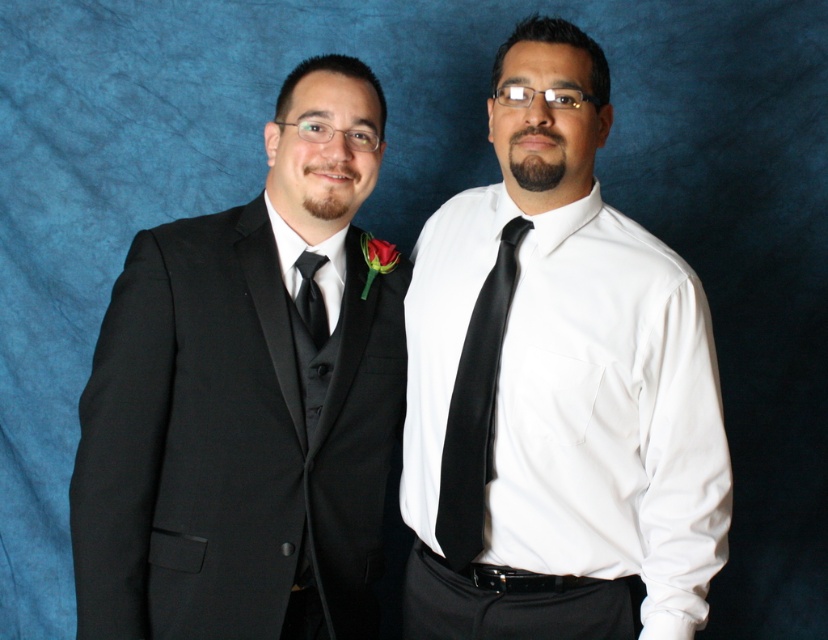
You are a tailor who needs to determine which tie requires more fabric for adjustments. Based on the image, which tie between the black satin tie at center and the black satin tie at left needs more fabric?

The black satin tie at center has a larger size compared to the black satin tie at left, so it requires more fabric for adjustments.

You are a tailor who needs to adjust the length of the ties for two clients. Both men are standing in the image described. Which tie, the black satin tie at center or the black satin tie at left, requires a shorter adjustment to match the other?

The black satin tie at left requires a shorter adjustment because the black satin tie at center is taller, so shortening the left one would match the height of the center one.

You are a tailor measuring the distance between the white satin shirt at center and the black satin tie at center for a custom suit. The minimum required distance for proper fitting is 4 inches. Is the current distance sufficient?

The white satin shirt at center and the black satin tie at center are 3.79 inches apart, which is less than the required 4 inches. Therefore, the current distance is insufficient for proper fitting.